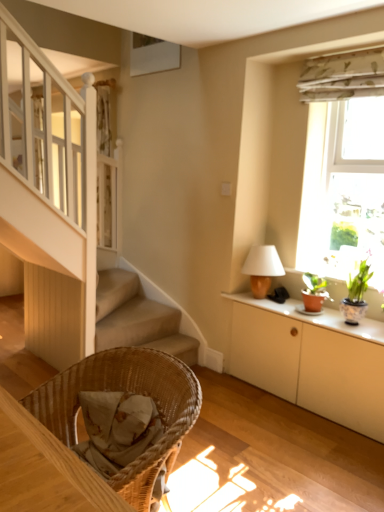
Question: Considering the relative positions of woven wood chair at lower left and green floral fabric at upper right in the image provided, is woven wood chair at lower left to the left of green floral fabric at upper right from the viewer's perspective?

Choices:
 (A) no
 (B) yes

Answer: (B)

Question: Does woven wood chair at lower left have a larger size compared to green floral fabric at upper right?

Choices:
 (A) yes
 (B) no

Answer: (A)

Question: From the image's perspective, would you say woven wood chair at lower left is shown under green floral fabric at upper right?

Choices:
 (A) no
 (B) yes

Answer: (B)

Question: From the image's perspective, is woven wood chair at lower left on top of green floral fabric at upper right?

Choices:
 (A) no
 (B) yes

Answer: (A)

Question: Does woven wood chair at lower left come behind green floral fabric at upper right?

Choices:
 (A) yes
 (B) no

Answer: (B)

Question: Considering the positions of matte brown table lamp at upper right and white matte cabinet at right in the image, is matte brown table lamp at upper right wider or thinner than white matte cabinet at right?

Choices:
 (A) thin
 (B) wide

Answer: (A)

Question: Would you say matte brown table lamp at upper right is inside or outside white matte cabinet at right?

Choices:
 (A) inside
 (B) outside

Answer: (B)

Question: From the image's perspective, is matte brown table lamp at upper right positioned above or below white matte cabinet at right?

Choices:
 (A) below
 (B) above

Answer: (B)

Question: Does point (269, 262) appear closer or farther from the camera than point (231, 350)?

Choices:
 (A) farther
 (B) closer

Answer: (B)

Question: Considering their positions, is green floral fabric at upper right located in front of or behind white matte cabinet at right?

Choices:
 (A) behind
 (B) front

Answer: (A)

Question: Does point tap(342, 55) appear closer or farther from the camera than point tap(352, 414)?

Choices:
 (A) farther
 (B) closer

Answer: (A)

Question: From a real-world perspective, relative to white matte cabinet at right, is green floral fabric at upper right vertically above or below?

Choices:
 (A) above
 (B) below

Answer: (A)

Question: Is green floral fabric at upper right to the left or to the right of white matte cabinet at right in the image?

Choices:
 (A) right
 (B) left

Answer: (A)

Question: From a real-world perspective, is white matte cabinet at right above or below matte brown table lamp at upper right?

Choices:
 (A) above
 (B) below

Answer: (B)

Question: Considering the positions of white matte cabinet at right and matte brown table lamp at upper right in the image, is white matte cabinet at right taller or shorter than matte brown table lamp at upper right?

Choices:
 (A) tall
 (B) short

Answer: (A)